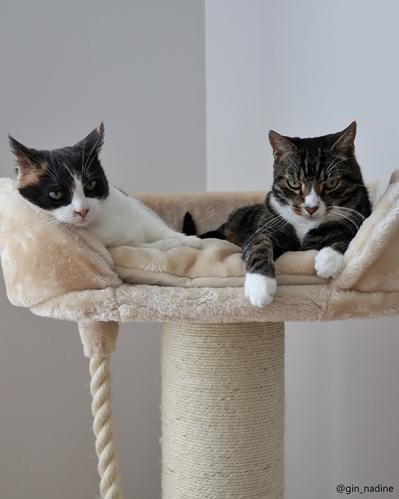
This screenshot has height=499, width=399. What are the coordinates of `cat post` in the screenshot? It's located at (194, 292).